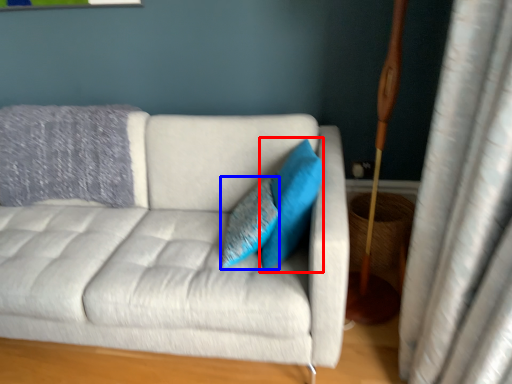
Question: Which object appears closest to the camera in this image, pillow (highlighted by a red box) or pillow (highlighted by a blue box)?

Choices:
 (A) pillow
 (B) pillow

Answer: (A)